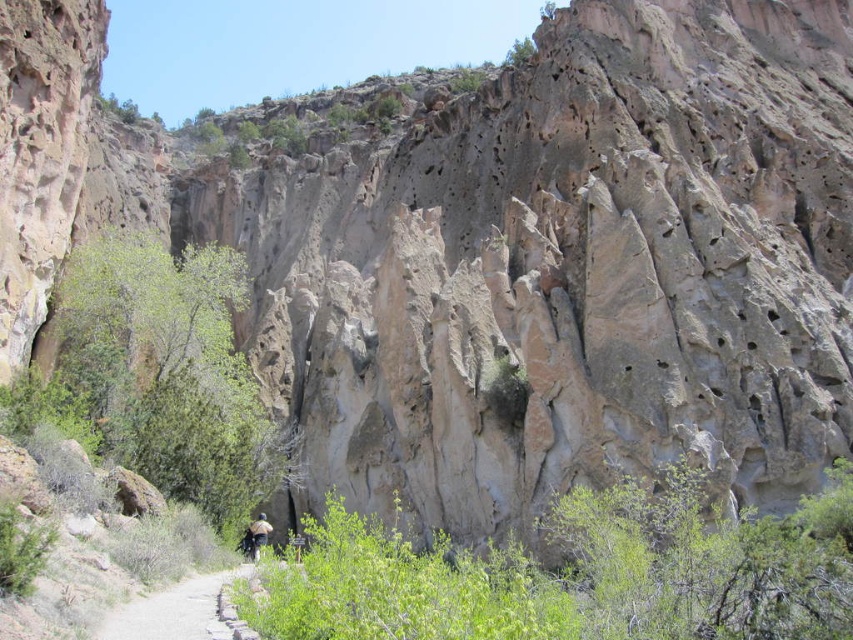
Is gravel path at center below brown fabric backpack at center?

No.

Which is behind, point (231, 577) or point (264, 536)?

The point (264, 536) is behind.

Is point (122, 627) closer to camera compared to point (262, 531)?

Yes, point (122, 627) is closer to viewer.

What are the coordinates of `gravel path at center` in the screenshot? It's located at pyautogui.click(x=175, y=611).